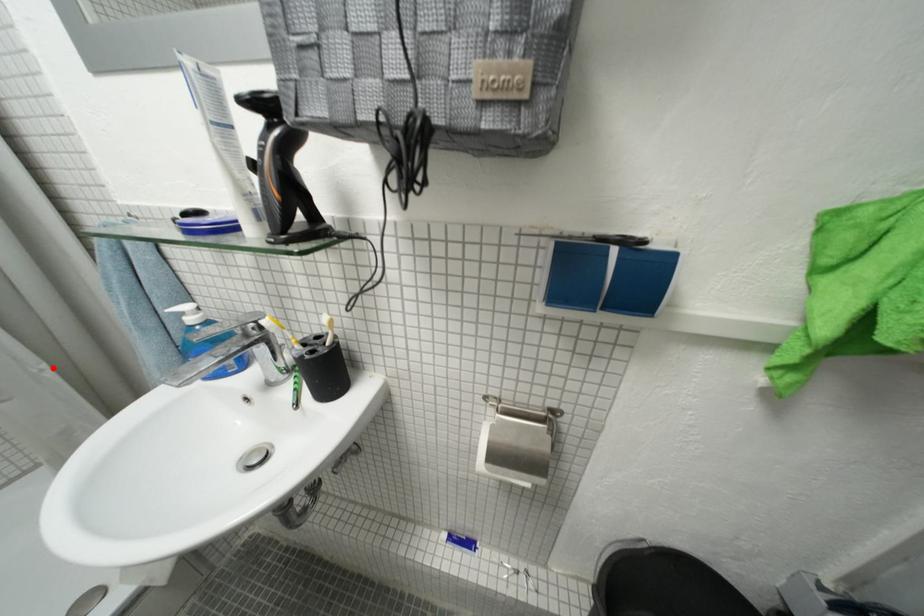
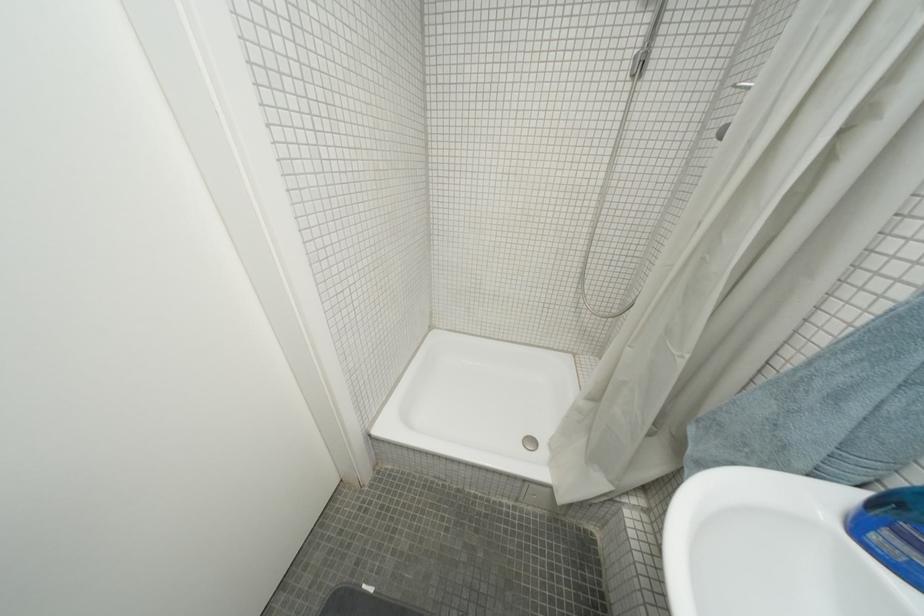
Where in the second image is the point corresponding to the highlighted location from the first image?

(697, 359)